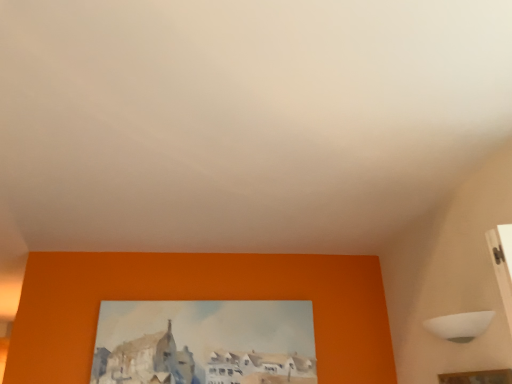
The height and width of the screenshot is (384, 512). What do you see at coordinates (460, 325) in the screenshot? I see `white matte lampshade at upper right` at bounding box center [460, 325].

This screenshot has height=384, width=512. Identify the location of white matte lampshade at upper right. (460, 325).

Locate an element on the screen. white matte lampshade at upper right is located at coordinates (460, 325).